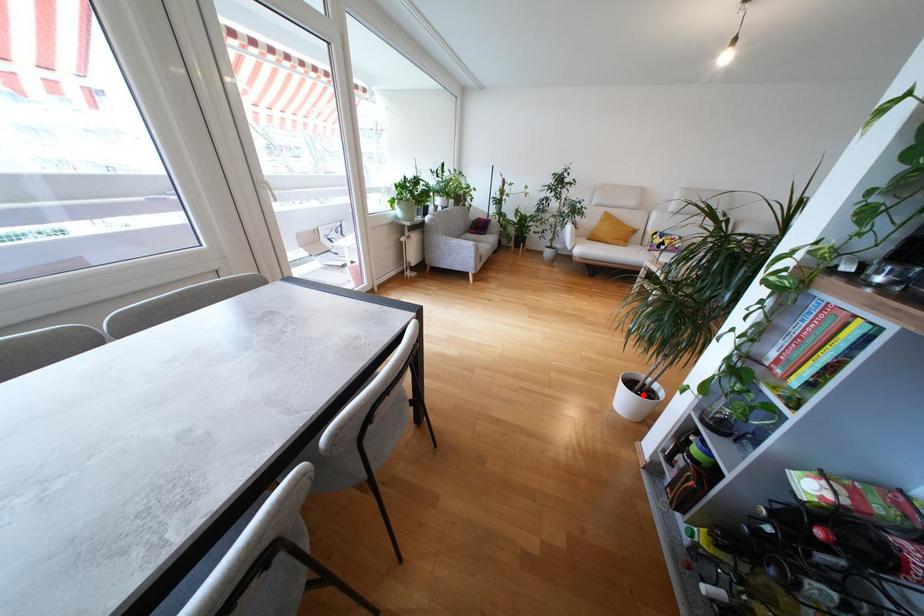
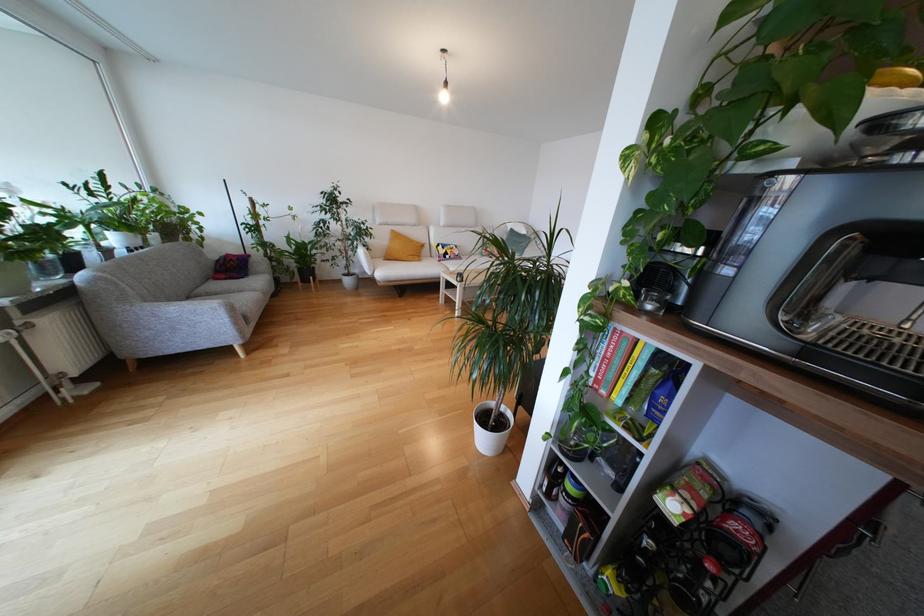
Question: I am providing you with two images of the same scene from different viewpoints. A red point is shown in image1. For the corresponding object point in image2, is it positioned nearer or farther from the camera?

Choices:
 (A) Nearer
 (B) Farther

Answer: (B)